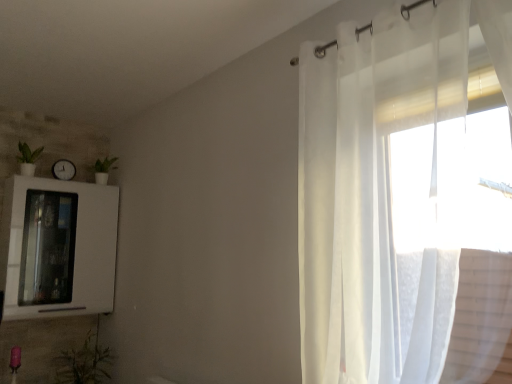
Question: In terms of height, does sheer white curtain at right look taller or shorter compared to white glossy medicine cabinet at left?

Choices:
 (A) tall
 (B) short

Answer: (A)

Question: From a real-world perspective, relative to white glossy medicine cabinet at left, is sheer white curtain at right vertically above or below?

Choices:
 (A) above
 (B) below

Answer: (A)

Question: Which object is the closest to the white glossy medicine cabinet at left?

Choices:
 (A) green leafy plant at lower left, which ranks as the 2th plant in top-to-bottom order
 (B) sheer white curtain at right
 (C) green matte plant at left, the first plant in the top-to-bottom sequence
 (D) white glossy clock at upper left

Answer: (D)

Question: Considering the real-world distances, which object is closest to the white glossy clock at upper left?

Choices:
 (A) white glossy medicine cabinet at left
 (B) green leafy plant at lower left, arranged as the second plant when viewed from the left
 (C) sheer white curtain at right
 (D) green matte plant at left, positioned as the 1th plant in left-to-right order

Answer: (D)